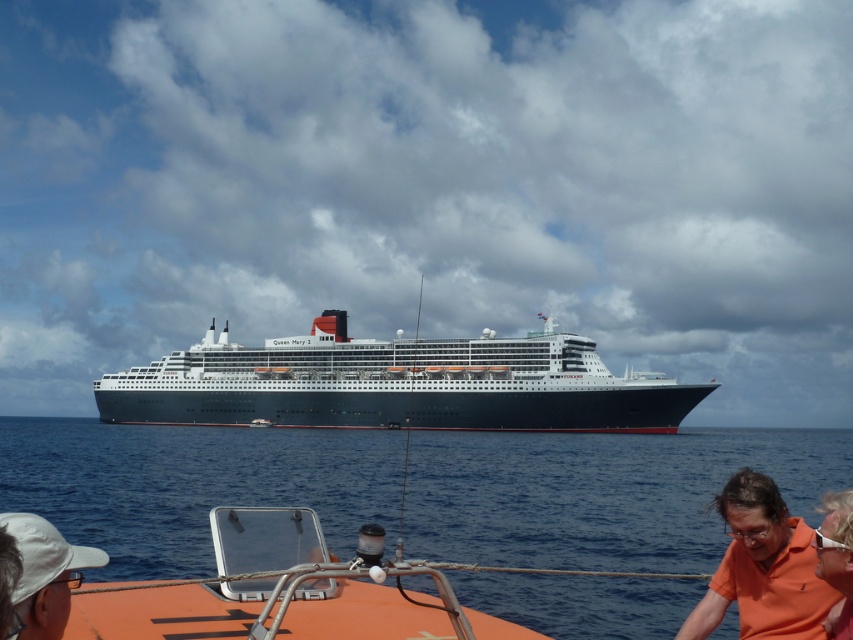
You are a photographer on the deck of the Queen Mary 2. You want to capture a wide shot of the scene that includes both the blue water at center and the orange cotton shirt at lower right. Given their sizes, which object will occupy more of the frame in your photo?

The blue water at center will occupy more of the frame in your photo since it has a larger size compared to the orange cotton shirt at lower right.

You are standing on the deck of the dark blue metallic ship at center and want to wave to someone on the orange fabric at lower right. In which direction should you turn your head to face them?

You should turn your head to the right to face the orange fabric at lower right, since the dark blue metallic ship at center is to the left of the orange fabric at lower right.